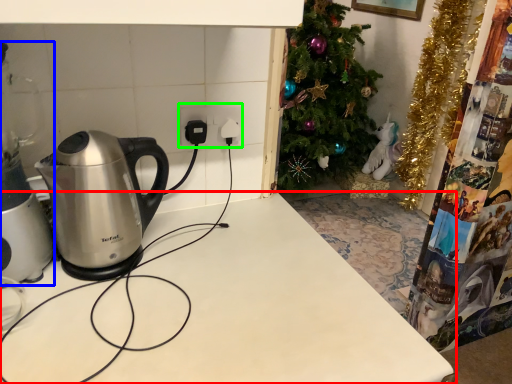
Question: Which object is positioned farthest from table (highlighted by a red box)? Select from appliance (highlighted by a blue box) and electric outlet (highlighted by a green box).

Choices:
 (A) appliance
 (B) electric outlet

Answer: (B)